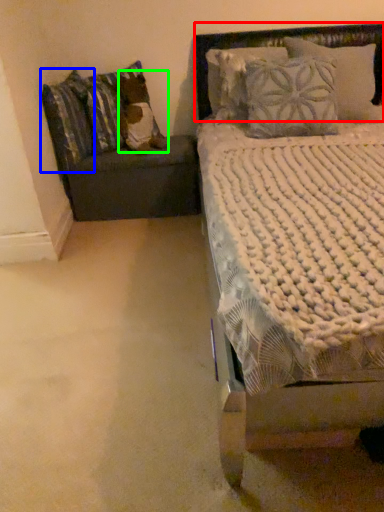
Question: Which is nearer to the headboard (highlighted by a red box)? pillow (highlighted by a blue box) or pillow (highlighted by a green box).

Choices:
 (A) pillow
 (B) pillow

Answer: (B)